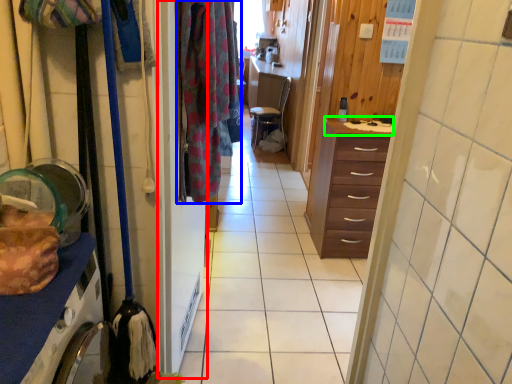
Question: Estimate the real-world distances between objects in this image. Which object is farther from screen door (highlighted by a red box), clothing (highlighted by a blue box) or counter top (highlighted by a green box)?

Choices:
 (A) clothing
 (B) counter top

Answer: (B)